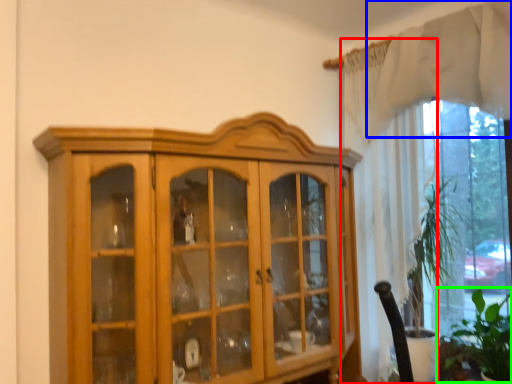
Question: Based on their relative distances, which object is nearer to curtain (highlighted by a red box)? Choose from curtain (highlighted by a blue box) and plant (highlighted by a green box).

Choices:
 (A) curtain
 (B) plant

Answer: (A)